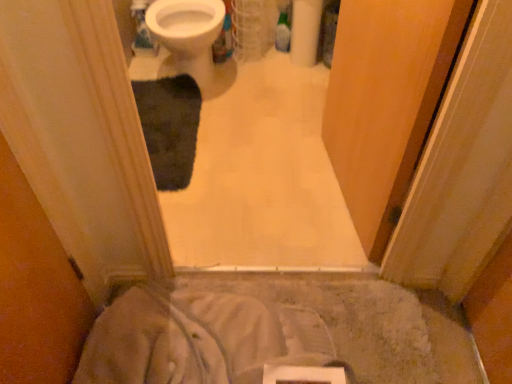
Image resolution: width=512 pixels, height=384 pixels. What are the coordinates of `free spot below wooden screen door at center (from a real-world perspective)` in the screenshot? It's located at (334, 193).